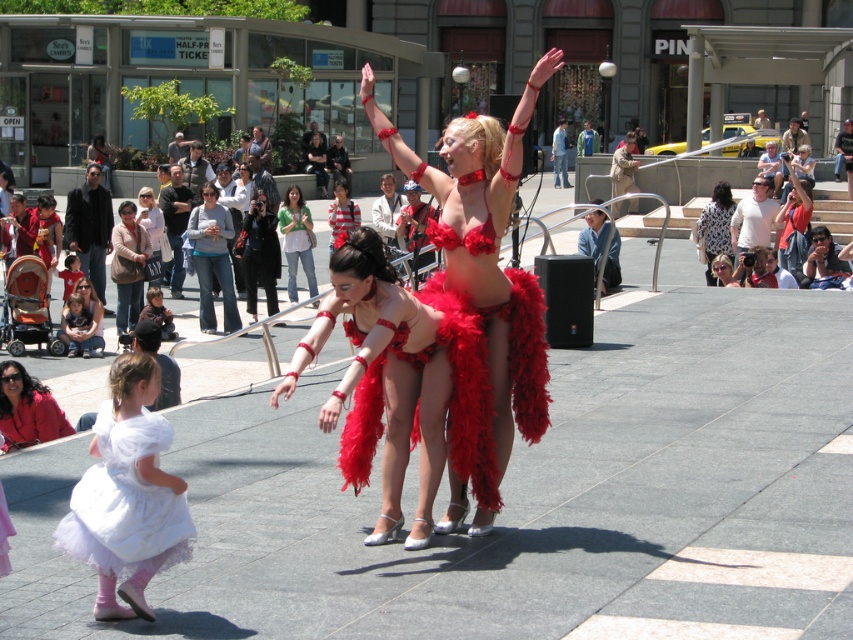
Question: Which point appears closest to the camera in this image?

Choices:
 (A) (45, 396)
 (B) (283, 211)
 (C) (349, 218)

Answer: (A)

Question: Which object is farther from the camera taking this photo?

Choices:
 (A) matte black camera at upper right
 (B) matte red feathered bikini at center
 (C) red satin bikini top at center

Answer: (A)

Question: Does matte red feathered bikini at center have a lesser width compared to red satin bikini top at center?

Choices:
 (A) yes
 (B) no

Answer: (B)

Question: Does leopard print dress at center appear on the right side of red satin bikini top at center?

Choices:
 (A) yes
 (B) no

Answer: (A)

Question: Which point is farther from the camera taking this photo?

Choices:
 (A) coord(821,244)
 (B) coord(431,220)
 (C) coord(287,212)
 (D) coord(436,435)

Answer: (C)

Question: Can you confirm if green fabric shirt at center is positioned to the left of red satin bikini top at center?

Choices:
 (A) yes
 (B) no

Answer: (A)